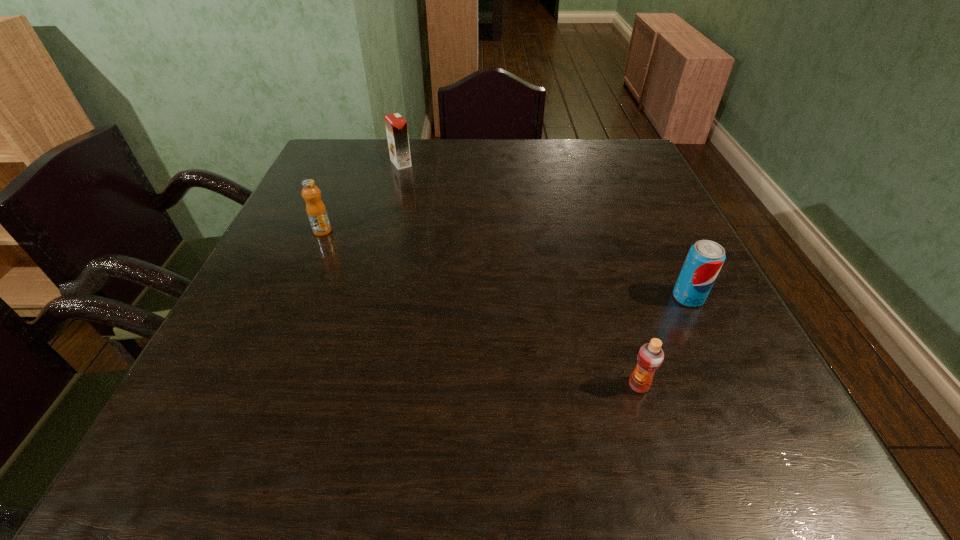
Locate an element on the screen. blank space at the far right corner of the desktop is located at coordinates (594, 153).

Locate an element on the screen. Image resolution: width=960 pixels, height=540 pixels. empty location between the leftmost object and the second nearest object is located at coordinates (505, 264).

Identify the location of unoccupied area between the rightmost object and the nearest orange juice. This screenshot has height=540, width=960. (663, 341).

Locate an element on the screen. empty space between the third nearest object and the nearest object is located at coordinates (481, 308).

This screenshot has height=540, width=960. I want to click on free spot between the rightmost object and the third object from right to left, so click(x=544, y=230).

Image resolution: width=960 pixels, height=540 pixels. I want to click on blank region between the second farthest orange juice and the soda can, so click(505, 264).

You are a GUI agent. You are given a task and a screenshot of the screen. Output one action in this format:
    pyautogui.click(x=<x>, y=<y>)
    Task: Click on the free area in between the second farthest orange juice and the nearest object
    This screenshot has height=540, width=960.
    Given the screenshot: What is the action you would take?
    pyautogui.click(x=481, y=308)

Where is `free spot between the second farthest orange juice and the third object from right to left`? The image size is (960, 540). free spot between the second farthest orange juice and the third object from right to left is located at coordinates (362, 197).

Locate an element on the screen. This screenshot has width=960, height=540. vacant area between the rightmost object and the farthest orange juice is located at coordinates (544, 230).

Identify the location of empty space that is in between the leftmost orange juice and the farthest orange juice. (362, 197).